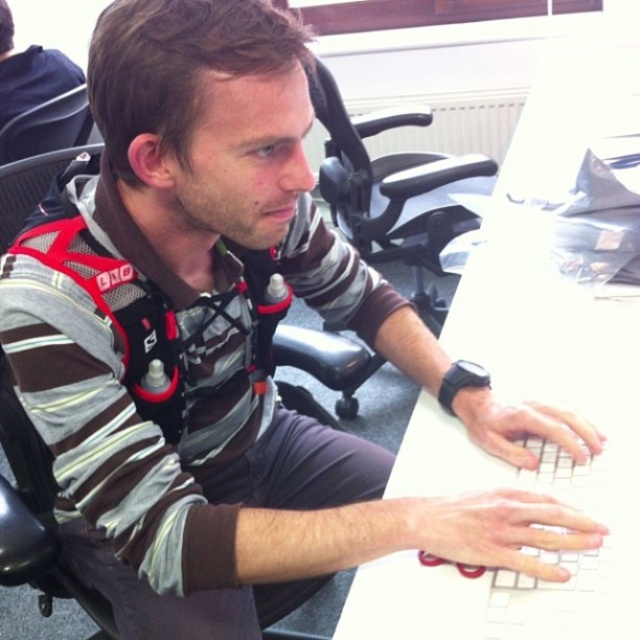
Question: Does white plastic keyboard at center appear on the right side of matte black shirt at upper left?

Choices:
 (A) no
 (B) yes

Answer: (B)

Question: Is white plastic keyboard at center bigger than matte black shirt at upper left?

Choices:
 (A) yes
 (B) no

Answer: (A)

Question: Is white plastic keyboard at center further to the viewer compared to black plastic chair at center?

Choices:
 (A) no
 (B) yes

Answer: (A)

Question: Which of the following is the farthest from the observer?

Choices:
 (A) (3, 12)
 (B) (8, 536)
 (C) (460, 308)

Answer: (A)

Question: Which of the following is the farthest from the observer?

Choices:
 (A) (637, 346)
 (B) (353, 356)

Answer: (B)

Question: Among these points, which one is nearest to the camera?

Choices:
 (A) 32,49
 (B) 388,163
 (C) 12,170
 (D) 632,109

Answer: (C)